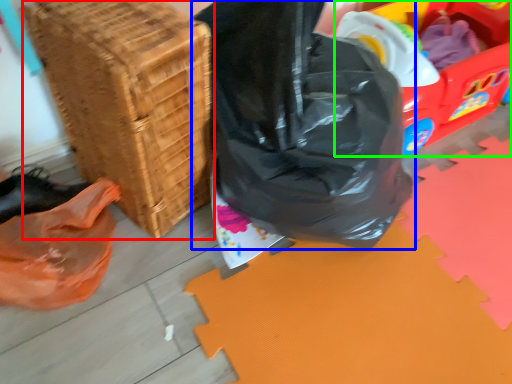
Question: Which is farther away from basket (highlighted by a red box)? plastic bag (highlighted by a blue box) or wagon (highlighted by a green box)?

Choices:
 (A) plastic bag
 (B) wagon

Answer: (B)